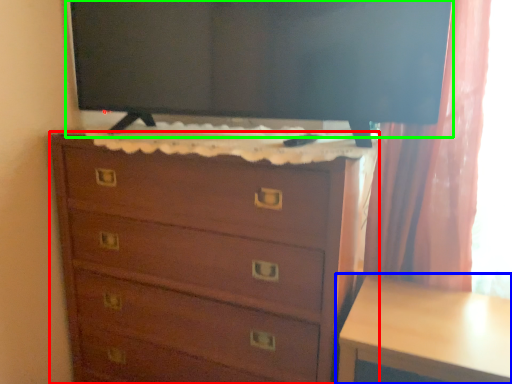
Question: Which is nearer to the chest of drawers (highlighted by a red box)? table (highlighted by a blue box) or tv show (highlighted by a green box).

Choices:
 (A) table
 (B) tv show

Answer: (A)